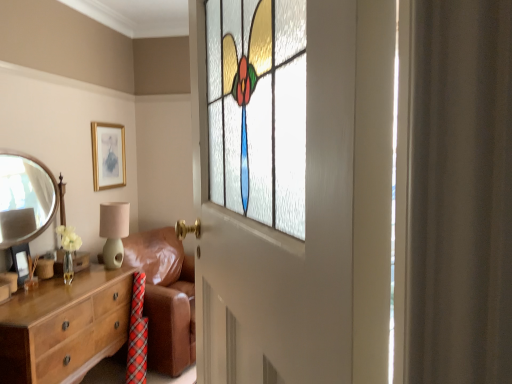
I want to click on free spot to the right of matte gold picture frame at lower left, which is the 2th picture frame from top to bottom, so click(45, 286).